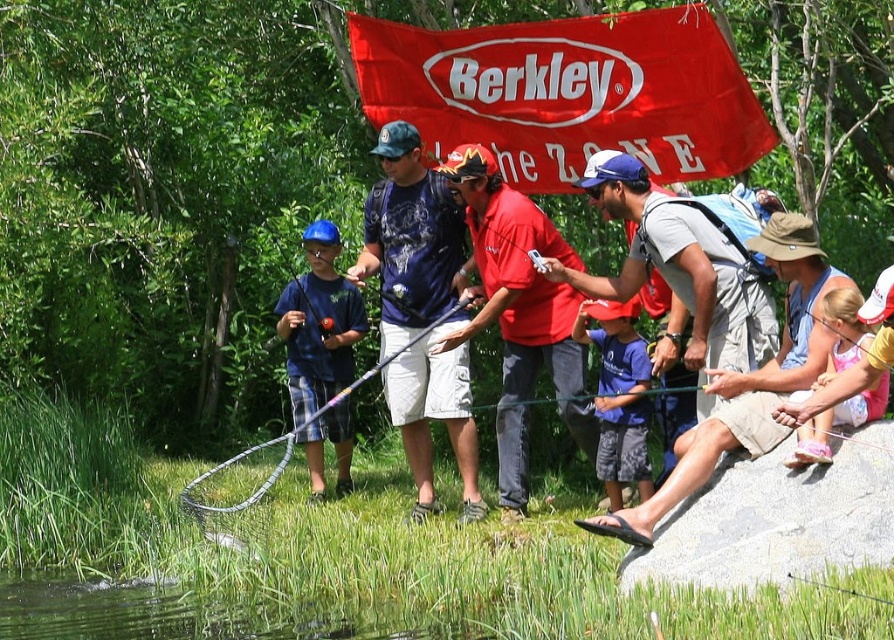
Can you confirm if light gray cotton shirt at center is taller than blue fabric shirt at center?

Incorrect, light gray cotton shirt at center's height is not larger of blue fabric shirt at center's.

Does light gray cotton shirt at center have a lesser height compared to blue fabric shirt at center?

Yes.

The height and width of the screenshot is (640, 894). Find the location of `light gray cotton shirt at center`. light gray cotton shirt at center is located at coordinates (679, 269).

Where is `light gray cotton shirt at center`? The image size is (894, 640). light gray cotton shirt at center is located at coordinates (679, 269).

Is point (741, 480) positioned after point (215, 472)?

No, (741, 480) is in front of (215, 472).

Can you confirm if gray smooth rock at lower right is shorter than silver metallic fishing pole at center?

Indeed, gray smooth rock at lower right has a lesser height compared to silver metallic fishing pole at center.

This screenshot has height=640, width=894. In order to click on gray smooth rock at lower right in this screenshot , I will do `click(777, 518)`.

Does pink fabric dress at lower right have a greater height compared to silver metallic fishing pole at center?

No.

Who is more forward, (829, 360) or (403, 352)?

Point (829, 360)

At what (x,y) coordinates should I click in order to perform the action: click on pink fabric dress at lower right. Please return your answer as a coordinate pair (x, y). The image size is (894, 640). Looking at the image, I should click on (838, 420).